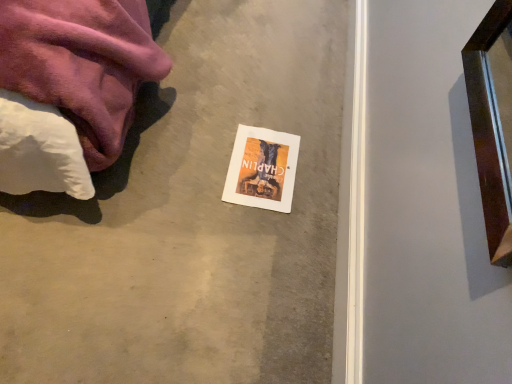
Find the location of a particular element. The height and width of the screenshot is (384, 512). unoccupied space behind orange matte paper flyer at center is located at coordinates (273, 107).